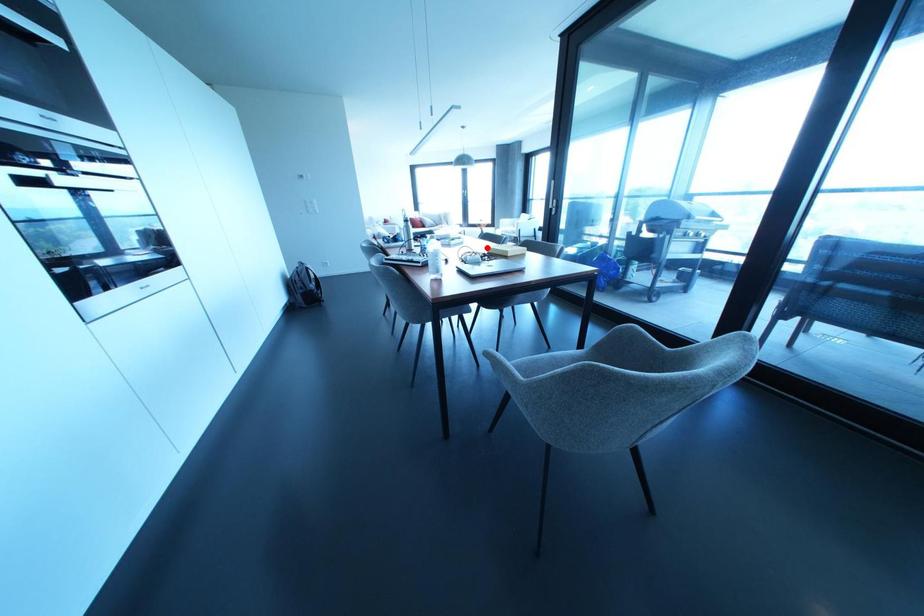
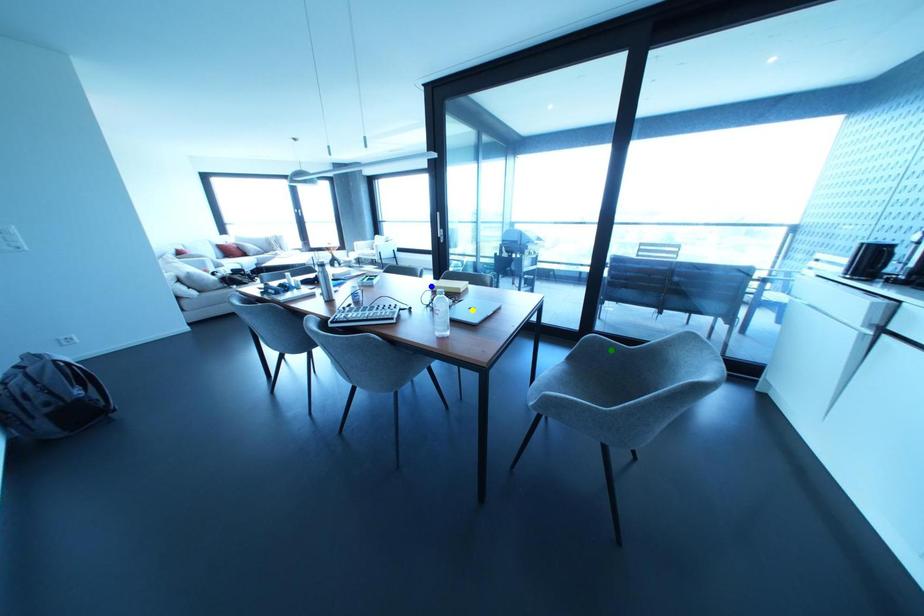
Question: I am providing you with two images of the same scene from different viewpoints. A red point is marked on the first image. You are given multiple points on the second image. Which point in image 2 is actually the same real-world point as the red point in image 1?

Choices:
 (A) blue point
 (B) green point
 (C) yellow point

Answer: (A)